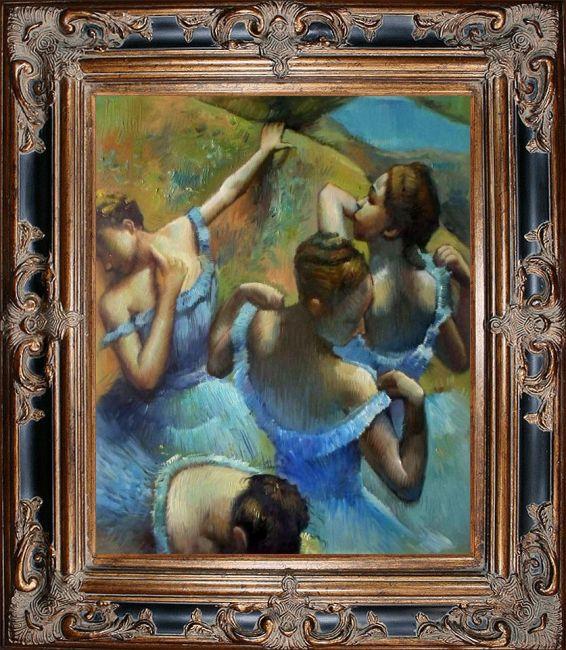
You are a GUI agent. You are given a task and a screenshot of the screen. Output one action in this format:
    pyautogui.click(x=<x>, y=<y>)
    Task: Click on the framed painting
    This screenshot has height=650, width=566.
    Given the screenshot: What is the action you would take?
    pyautogui.click(x=276, y=49)